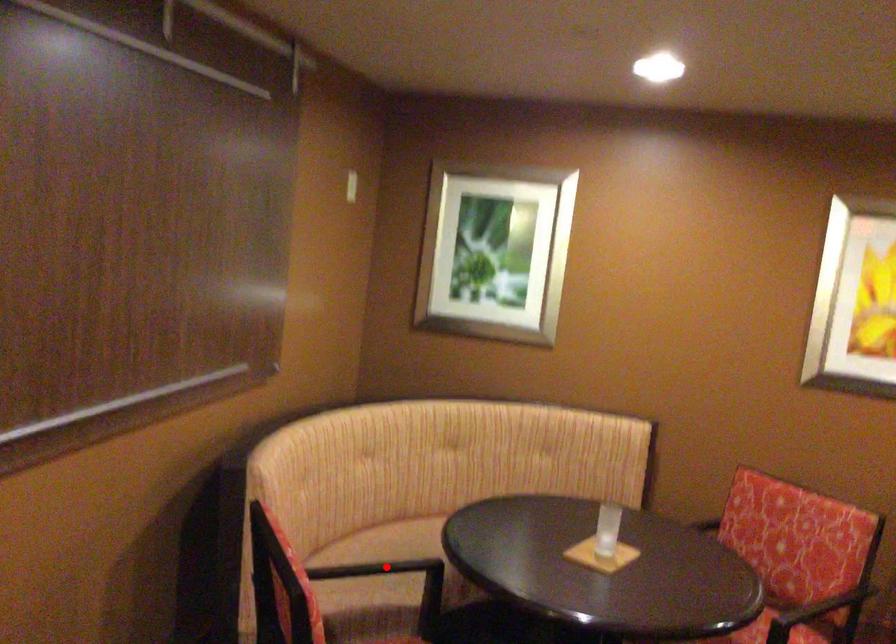
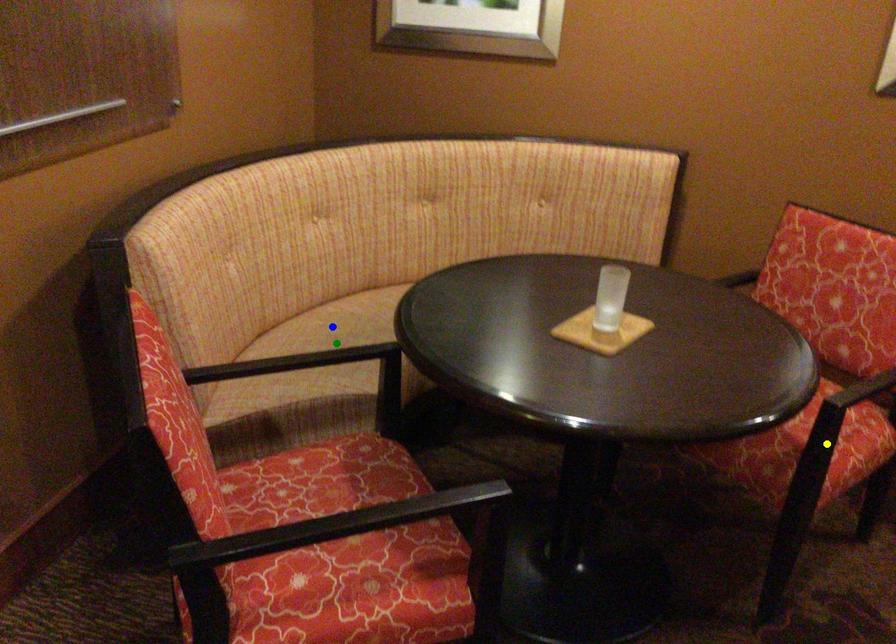
Question: I am providing you with two images of the same scene from different viewpoints. A red point is marked on the first image. You are given multiple points on the second image. Which point in image 2 is actually the same real-world point as the red point in image 1?

Choices:
 (A) blue point
 (B) yellow point
 (C) green point

Answer: (C)